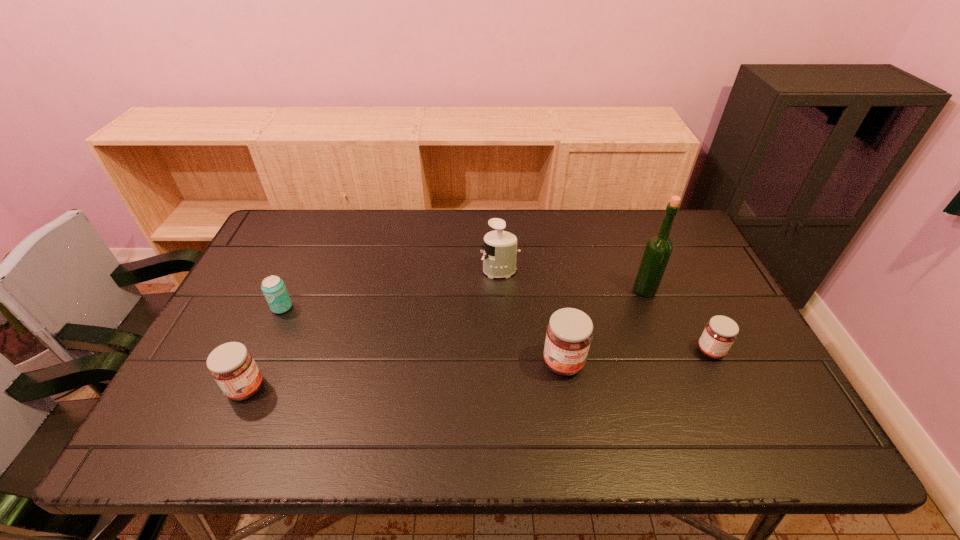
If equal spacing is the goal by inserting an additional jam among them, please point out a vacant space for this new jam. Please provide its 2D coordinates. Your answer should be formatted as a tuple, i.e. [(x, y)], where the tuple contains the x and y coordinates of a point satisfying the conditions above.

[(409, 375)]